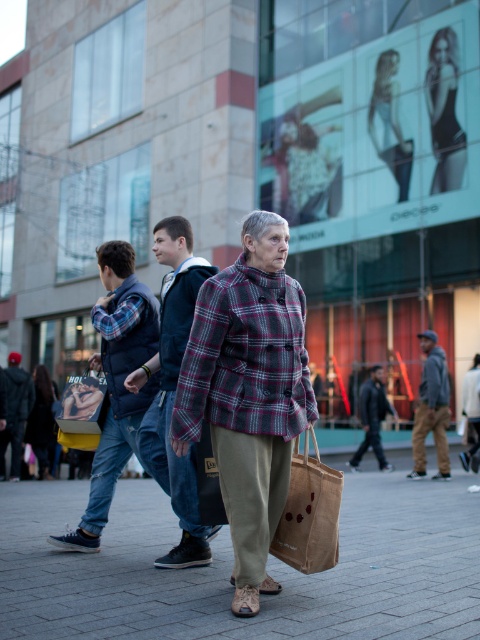
Where is the plaid fabric jacket at center located in the image?

The plaid fabric jacket at center is located at the 2D coordinates point (x=173, y=390) in the image.

You are a delivery person needing to hand over a package to the recipient. You see the gray hoodie at right and the brown canvas bag at center. Which object is closer to your current position?

The gray hoodie at right is closer to your current position because the distance between them is 19.26 feet, so the gray hoodie at right is nearer than the brown canvas bag at center.

Based on the scene description, where is the plaid fabric at center located in terms of coordinates?

The plaid fabric at center is located at coordinates (249, 394).